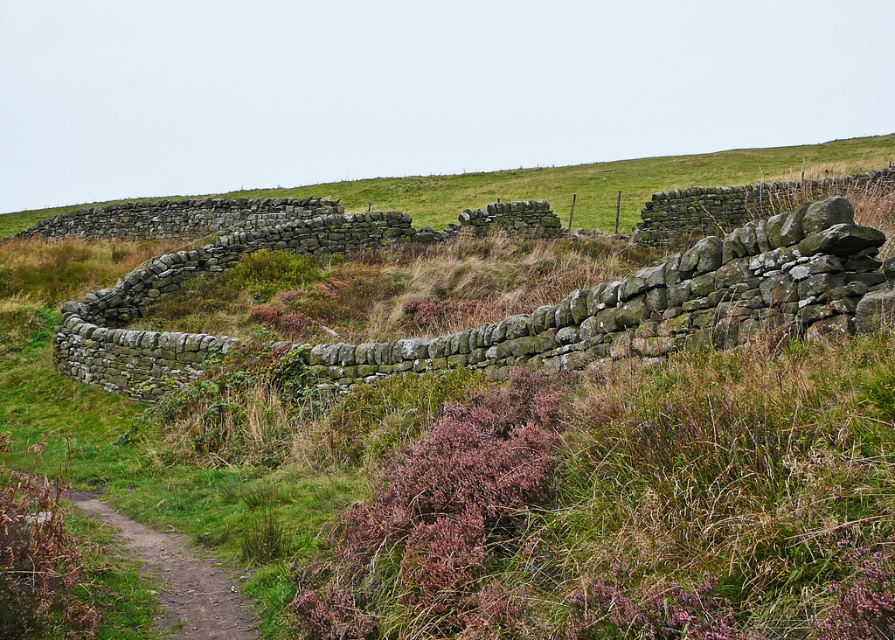
Can you confirm if green mossy stone wall at center is smaller than rustic stone wall at upper center?

Yes, green mossy stone wall at center is smaller than rustic stone wall at upper center.

In the scene shown: Is green mossy stone wall at center above rustic stone wall at upper center?

No, green mossy stone wall at center is not above rustic stone wall at upper center.

Describe the element at coordinates (592, 468) in the screenshot. I see `green mossy stone wall at center` at that location.

Identify the location of green mossy stone wall at center. The image size is (895, 640). (592, 468).

Does green mossy stone wall at center appear under dirt/gravel path at lower left?

No, green mossy stone wall at center is not below dirt/gravel path at lower left.

Is point (256, 378) positioned in front of point (207, 573)?

No, it is not.

Is point (504, 624) positioned after point (112, 509)?

No.

At what (x,y) coordinates should I click in order to perform the action: click on green mossy stone wall at center. Please return your answer as a coordinate pair (x, y). This screenshot has width=895, height=640. Looking at the image, I should click on (592, 468).

What do you see at coordinates (592, 180) in the screenshot?
I see `rustic stone wall at upper center` at bounding box center [592, 180].

Is point (575, 188) positioned before point (175, 634)?

No, (575, 188) is further to viewer.

Locate an element on the screen. Image resolution: width=895 pixels, height=640 pixels. rustic stone wall at upper center is located at coordinates (592, 180).